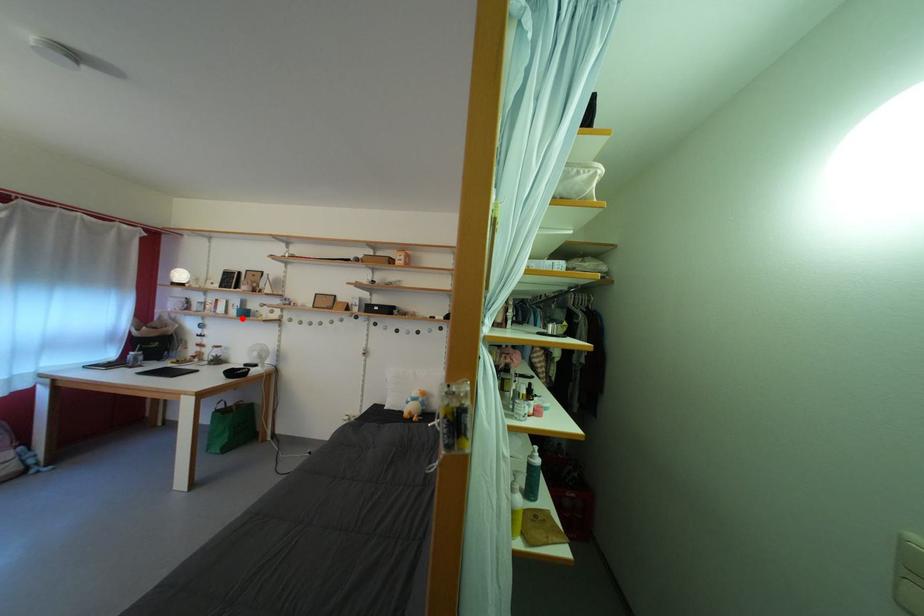
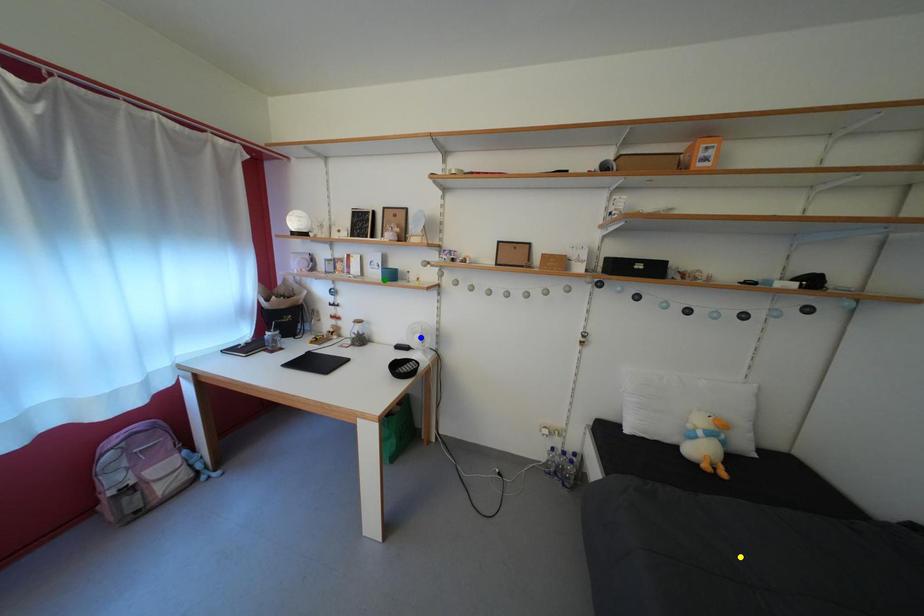
Question: I am providing you with two images of the same scene from different viewpoints. A red point is marked on the first image. You are given multiple points on the second image. In image 2, which mark is for the same physical point as the one in image 1?

Choices:
 (A) green point
 (B) yellow point
 (C) blue point

Answer: (A)